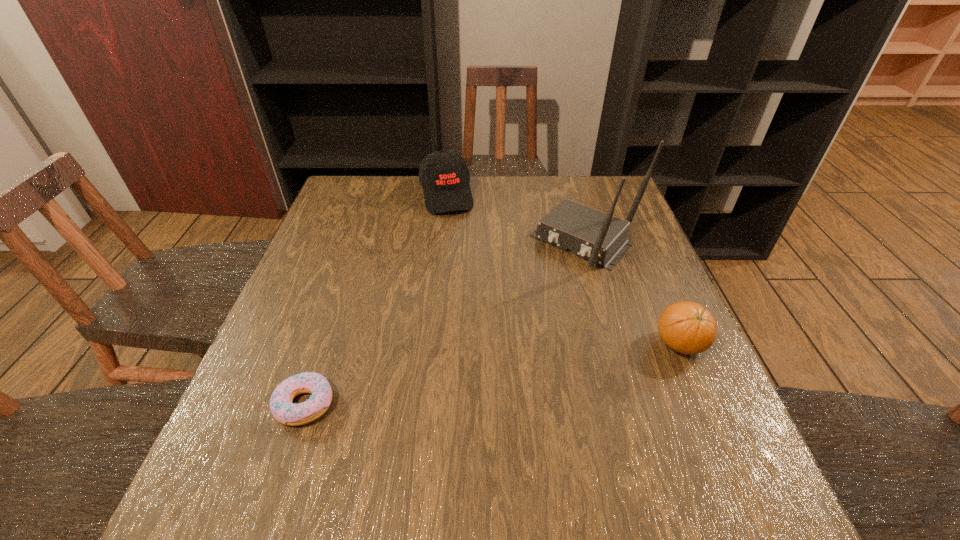
Where is `the nearest object`? the nearest object is located at coordinates (283, 410).

Where is `the leftmost object`? the leftmost object is located at coordinates (283, 410).

I want to click on orange, so click(686, 327).

Where is `the second shortest object`? This screenshot has width=960, height=540. the second shortest object is located at coordinates (686, 327).

Where is `the tallest object`? the tallest object is located at coordinates (601, 238).

The width and height of the screenshot is (960, 540). I want to click on baseball cap, so [x=444, y=175].

The width and height of the screenshot is (960, 540). I want to click on vacant space located on the left of the shortest object, so click(x=238, y=404).

The image size is (960, 540). What are the coordinates of `vacant region located 0.080m on the front of the third farthest object` in the screenshot? It's located at (703, 399).

Where is `free point located 0.050m on the back of the router to connect cables`? free point located 0.050m on the back of the router to connect cables is located at coordinates (547, 281).

The image size is (960, 540). I want to click on free spot located 0.260m on the back of the router to connect cables, so click(x=497, y=332).